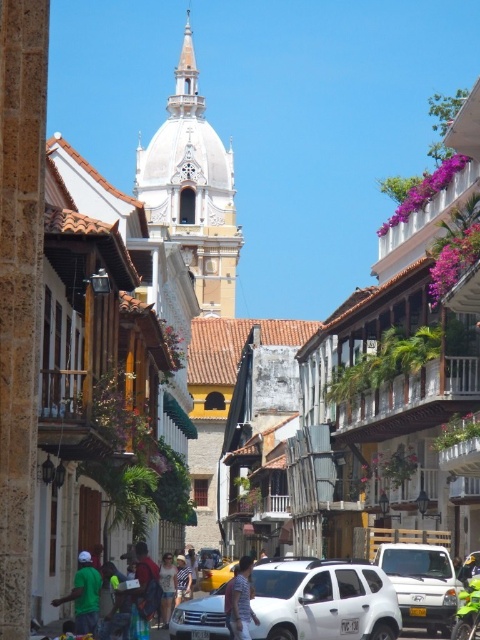
Does point (377, 572) come farther from viewer compared to point (240, 612)?

Yes, point (377, 572) is behind point (240, 612).

Can you confirm if white matte suv at center is positioned to the left of light brown leather jacket at center?

Incorrect, white matte suv at center is not on the left side of light brown leather jacket at center.

Where is `white matte suv at center`? This screenshot has width=480, height=640. white matte suv at center is located at coordinates (323, 600).

Who is positioned more to the right, white matte suv at center or metallic silver car at center?

white matte suv at center

Describe the element at coordinates (323, 600) in the screenshot. I see `white matte suv at center` at that location.

Locate an element on the screen. This screenshot has width=480, height=640. white matte suv at center is located at coordinates (323, 600).

Who is higher up, denim shorts at center or denim shorts at lower center?

denim shorts at center is above.

Does denim shorts at center appear on the left side of denim shorts at lower center?

Yes, denim shorts at center is to the left of denim shorts at lower center.

Does point (170, 602) come farther from viewer compared to point (178, 556)?

No, it is not.

This screenshot has width=480, height=640. Find the location of `denim shorts at center`. denim shorts at center is located at coordinates (167, 588).